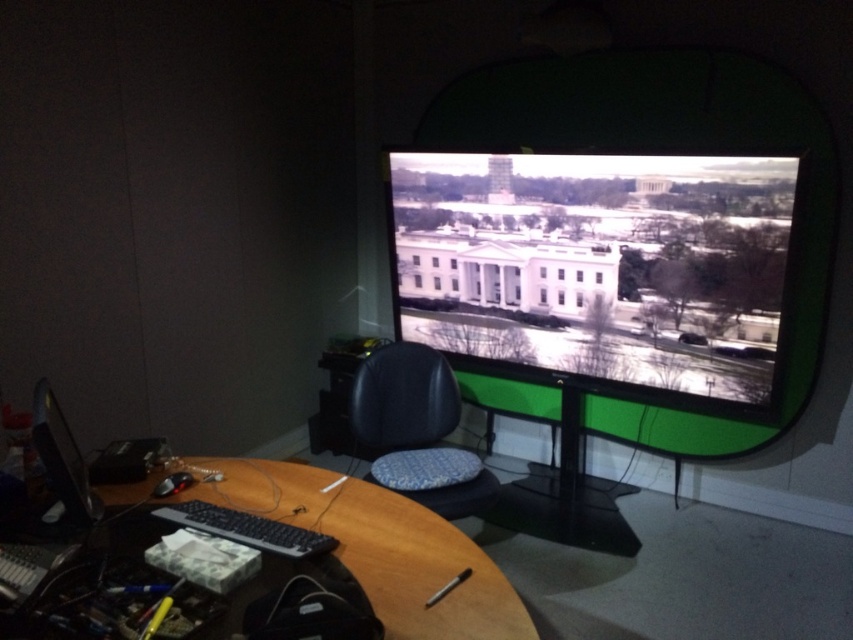
Question: Does matte black monitor at center have a larger size compared to black leather chair at center?

Choices:
 (A) yes
 (B) no

Answer: (A)

Question: Is wooden at center closer to the viewer compared to matte black monitor at lower left?

Choices:
 (A) yes
 (B) no

Answer: (A)

Question: Which point is closer to the camera?

Choices:
 (A) matte black monitor at lower left
 (B) black leather chair at center

Answer: (A)

Question: Which is farther from the wooden at center?

Choices:
 (A) matte black monitor at lower left
 (B) black leather chair at center

Answer: (B)

Question: From the image, what is the correct spatial relationship of matte black monitor at center in relation to black leather chair at center?

Choices:
 (A) above
 (B) below

Answer: (A)

Question: Which is farther from the matte black monitor at center?

Choices:
 (A) black leather chair at center
 (B) wooden at center
 (C) matte black monitor at lower left

Answer: (C)